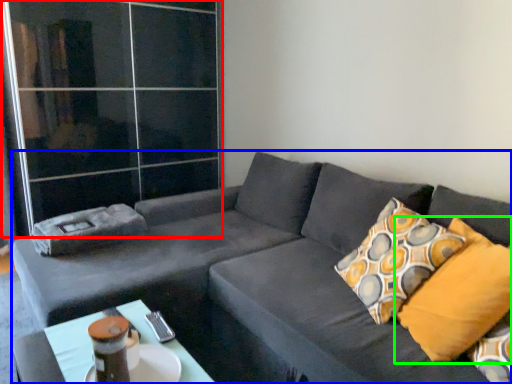
Question: Which object is positioned farthest from glass door (highlighted by a red box)? Select from studio couch (highlighted by a blue box) and pillow (highlighted by a green box).

Choices:
 (A) studio couch
 (B) pillow

Answer: (B)